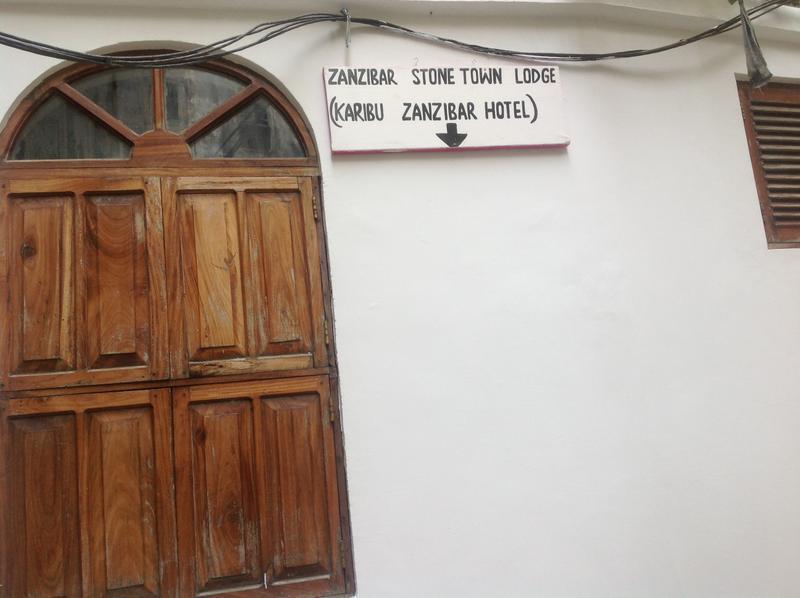
This screenshot has width=800, height=598. I want to click on dark brown vent on white wall, so click(754, 108).